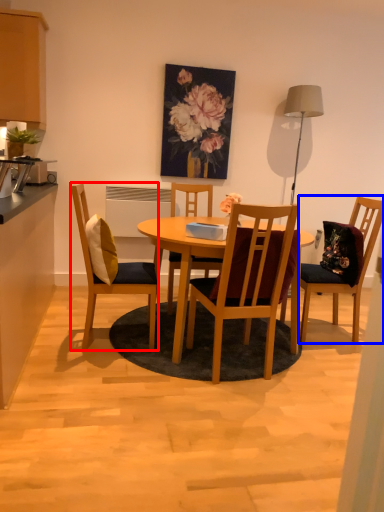
Question: Which object appears farthest to the camera in this image, chair (highlighted by a red box) or chair (highlighted by a blue box)?

Choices:
 (A) chair
 (B) chair

Answer: (B)